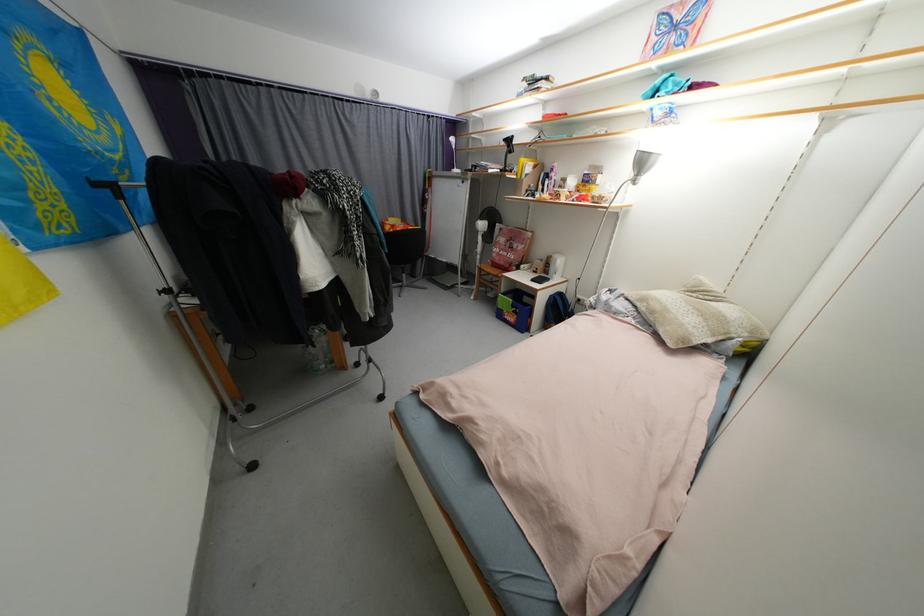
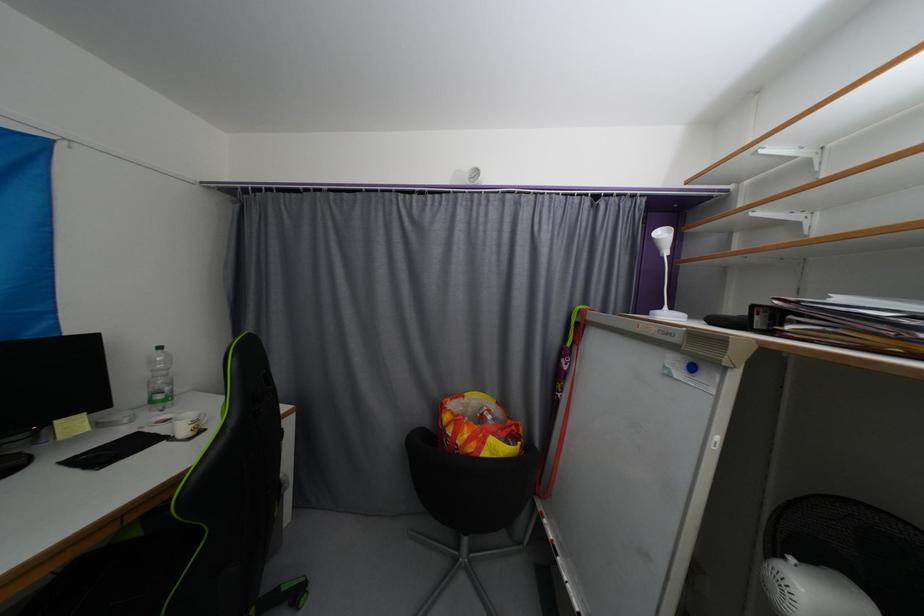
The point at [393,230] is marked in the first image. Where is the corresponding point in the second image?

(452, 419)